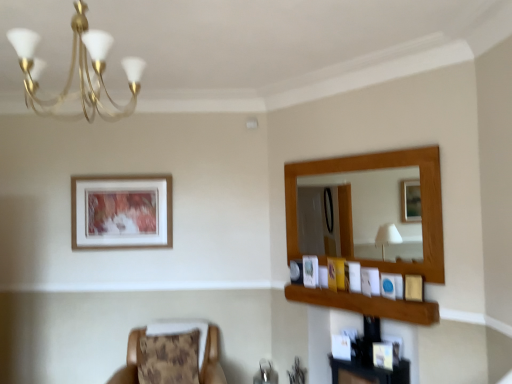
Locate an element on the screen. The height and width of the screenshot is (384, 512). blank space situated above wooden framed artwork at upper left, which is counted as the sixth picture frame, starting from the front (from a real-world perspective) is located at coordinates (121, 170).